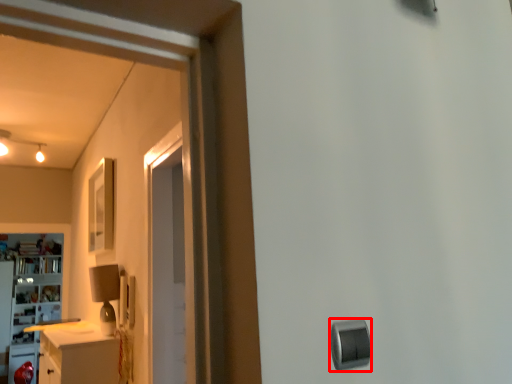
Question: From the image's perspective, considering the relative positions of knob (annotated by the red box) and cabinetry in the image provided, where is knob (annotated by the red box) located with respect to the staircase?

Choices:
 (A) below
 (B) above

Answer: (B)